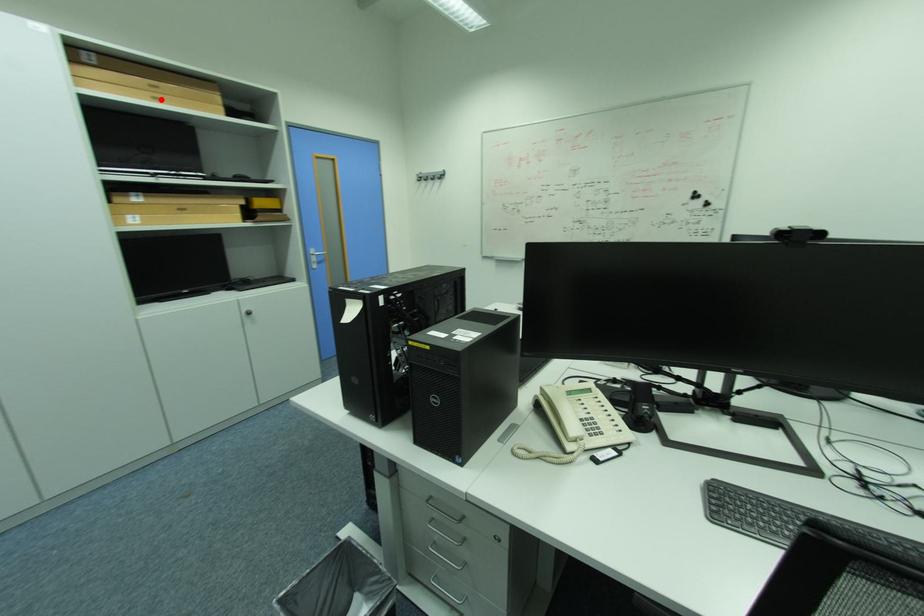
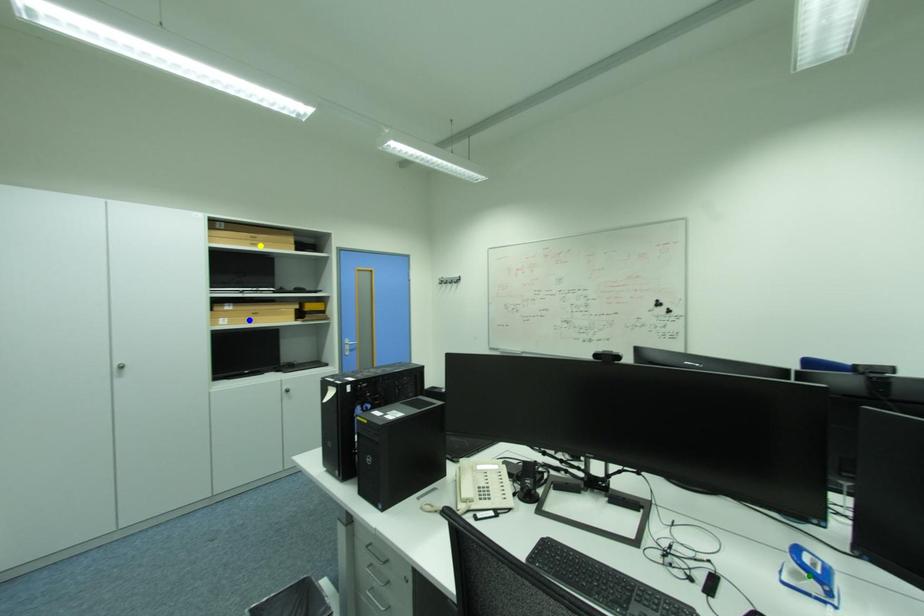
Question: I am providing you with two images of the same scene from different viewpoints. A red point is marked on the first image. You are given multiple points on the second image. Which point in image 2 represents the same 3d spot as the red point in image 1?

Choices:
 (A) green point
 (B) blue point
 (C) yellow point

Answer: (C)